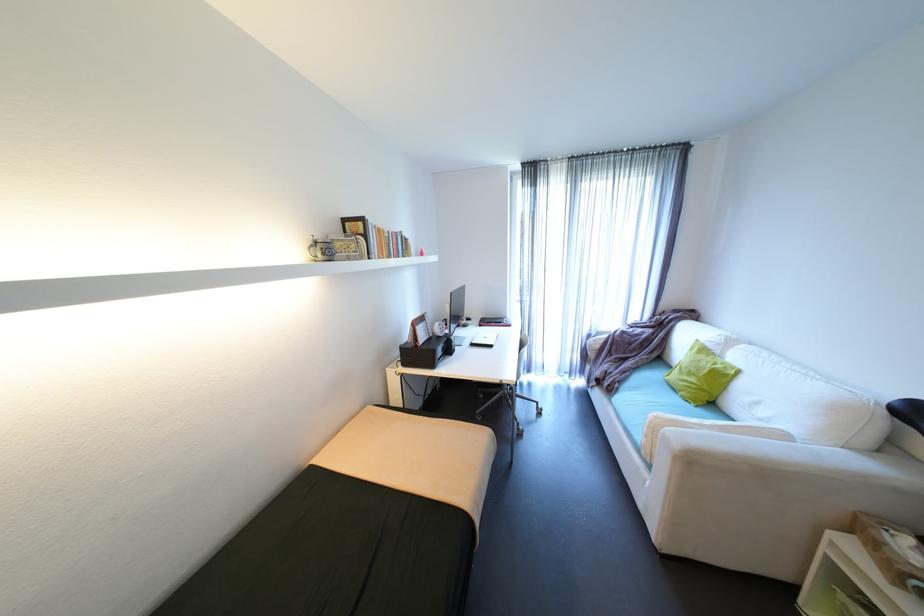
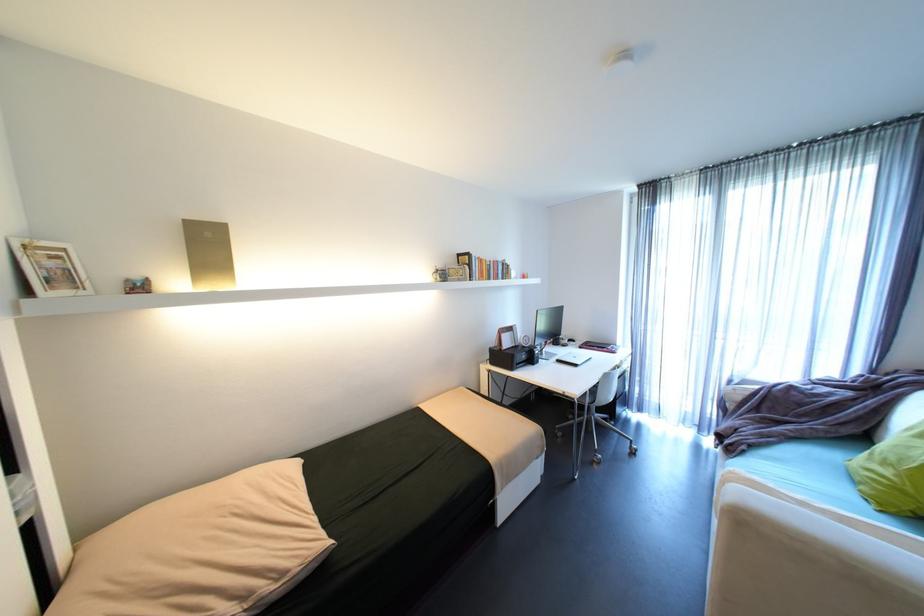
In the second image, find the point that corresponds to point 508,323 in the first image.

(612, 347)